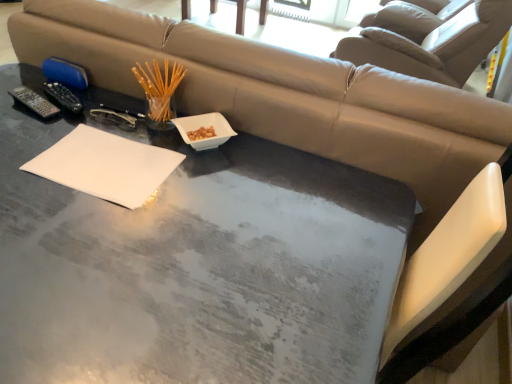
Where is `free location above white matte notepad at center (from a real-world perspective)`? The image size is (512, 384). free location above white matte notepad at center (from a real-world perspective) is located at coordinates point(111,160).